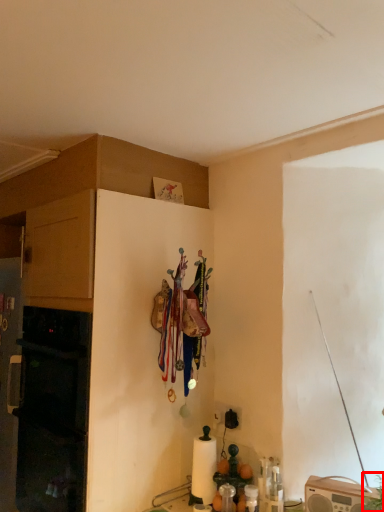
Question: From the image's perspective, where is plant (annotated by the red box) located relative to cabinetry?

Choices:
 (A) below
 (B) above

Answer: (A)